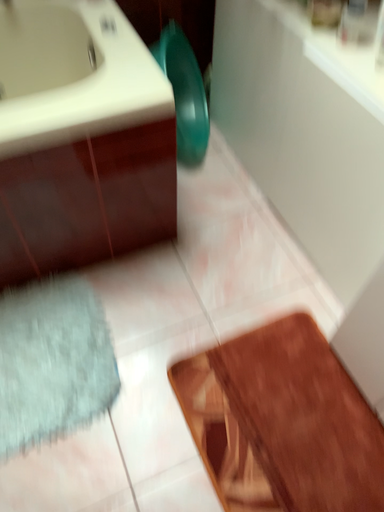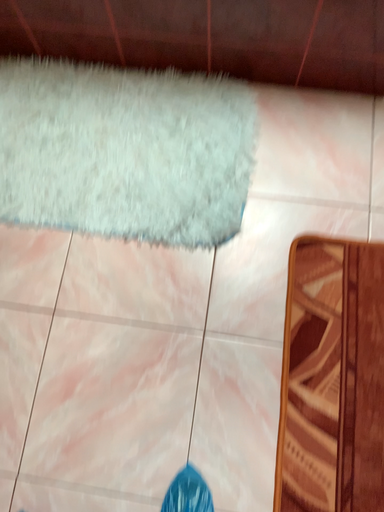
Question: How did the camera likely rotate when shooting the video?

Choices:
 (A) rotated upward
 (B) rotated downward

Answer: (B)